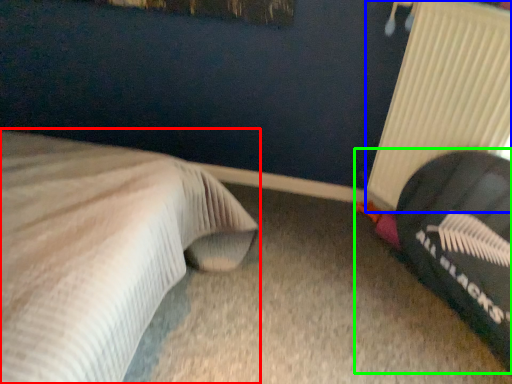
Question: Considering the real-world distances, which object is closest to bed (highlighted by a red box)? radiator (highlighted by a blue box) or bean bag chair (highlighted by a green box).

Choices:
 (A) radiator
 (B) bean bag chair

Answer: (B)